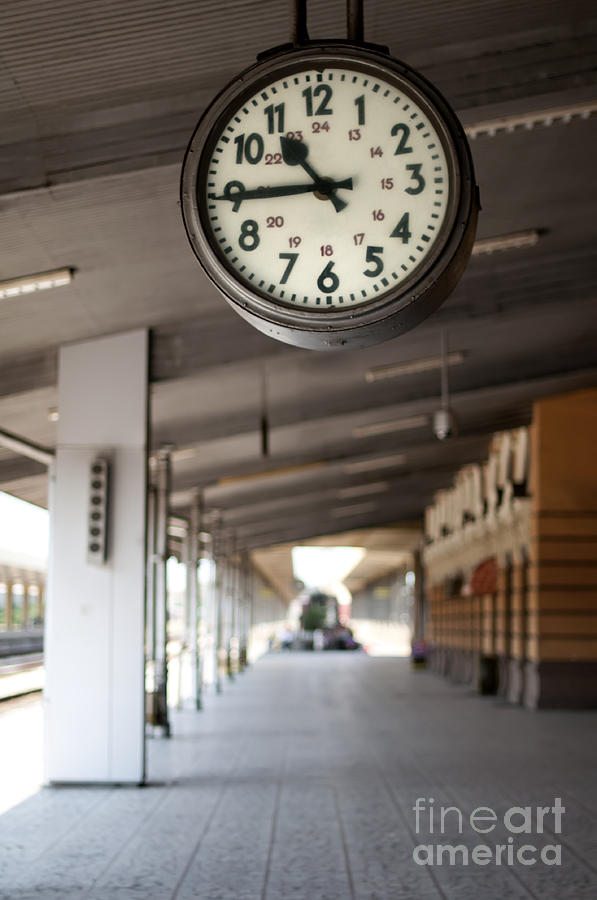
Locate an element on the screen. This screenshot has height=900, width=597. clock is located at coordinates point(347,147).